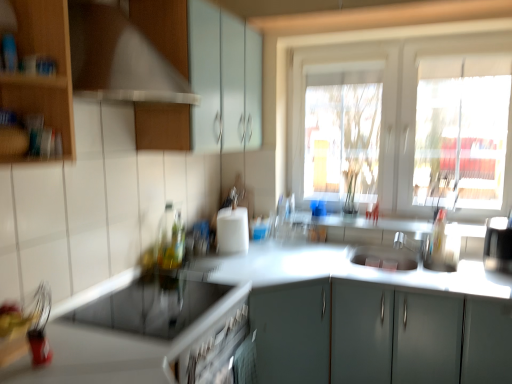
Find the location of a particular element. free space on the front side of white matte paper towel holder at center is located at coordinates (236, 259).